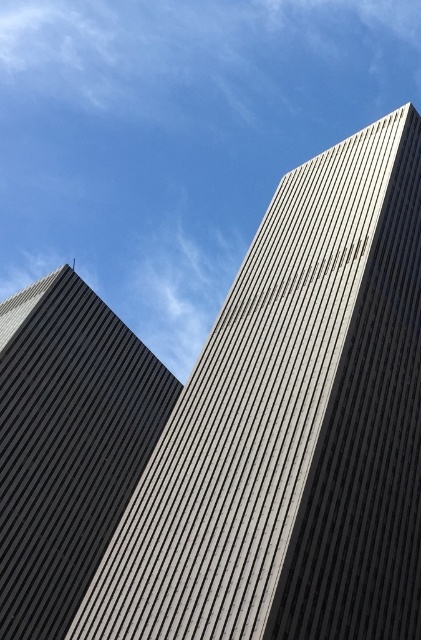
Does gray textured building at center have a greater width compared to dark gray textured building at left?

Indeed, gray textured building at center has a greater width compared to dark gray textured building at left.

Identify the location of gray textured building at center. The image size is (421, 640). (293, 428).